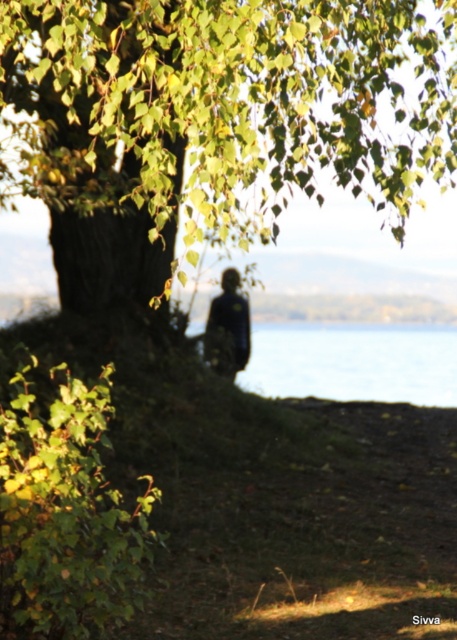
Question: Is green leafy tree at upper left to the left of dark blue fabric at center from the viewer's perspective?

Choices:
 (A) yes
 (B) no

Answer: (B)

Question: Which object is closer to the camera taking this photo?

Choices:
 (A) transparent water at center
 (B) green leafy tree at upper left

Answer: (B)

Question: Does green leafy tree at upper left come behind dark blue fabric at center?

Choices:
 (A) no
 (B) yes

Answer: (A)

Question: Does green leafy tree at upper left have a lesser width compared to transparent water at center?

Choices:
 (A) yes
 (B) no

Answer: (A)

Question: Which of these objects is positioned closest to the green leafy tree at upper left?

Choices:
 (A) transparent water at center
 (B) dark blue fabric at center

Answer: (B)

Question: Among these points, which one is farthest from the camera?

Choices:
 (A) (205, 353)
 (B) (302, 35)
 (C) (308, 356)

Answer: (C)